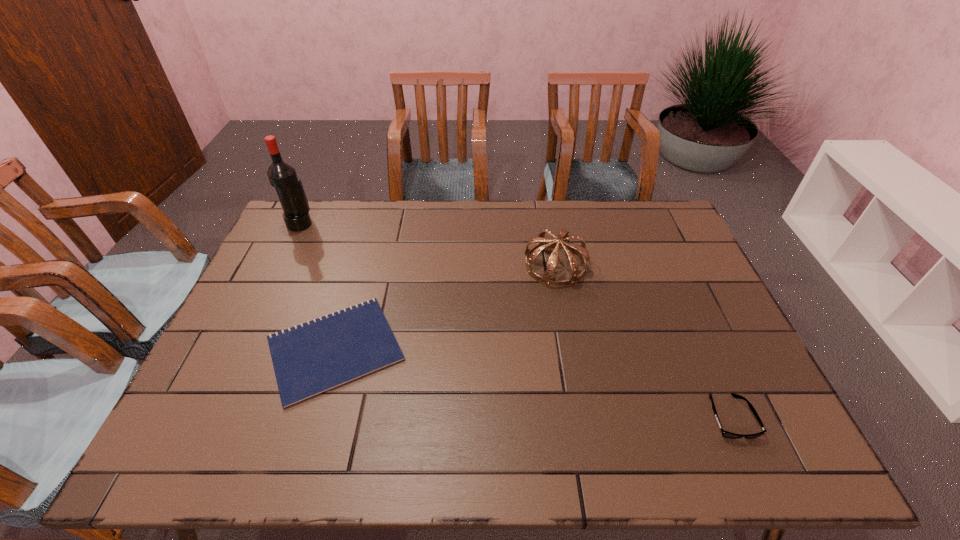
Where is `free spot between the third object from right to left and the second shortest object`? The width and height of the screenshot is (960, 540). free spot between the third object from right to left and the second shortest object is located at coordinates (533, 383).

This screenshot has width=960, height=540. I want to click on free area in between the rightmost object and the notepad, so click(533, 383).

What are the coordinates of `free space that is in between the sunglasses and the wine bottle` in the screenshot? It's located at (516, 320).

What are the coordinates of `the closest object to the leftmost object` in the screenshot? It's located at (314, 357).

Select which object appears as the second closest to the wine bottle. Please provide its 2D coordinates. Your answer should be formatted as a tuple, i.e. [(x, y)], where the tuple contains the x and y coordinates of a point satisfying the conditions above.

[(562, 241)]

Identify the location of free space that satisfies the following two spatial constraints: 1. on the front side of the wine bottle; 2. on the left side of the notepad. This screenshot has width=960, height=540. (239, 349).

Identify the location of free region that satisfies the following two spatial constraints: 1. on the front side of the farthest object; 2. on the left side of the notepad. This screenshot has height=540, width=960. (239, 349).